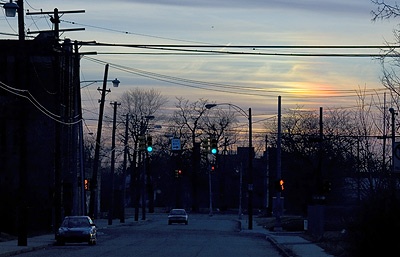
The height and width of the screenshot is (257, 400). What are the coordinates of `hood` in the screenshot? It's located at 73,231, 178,216.